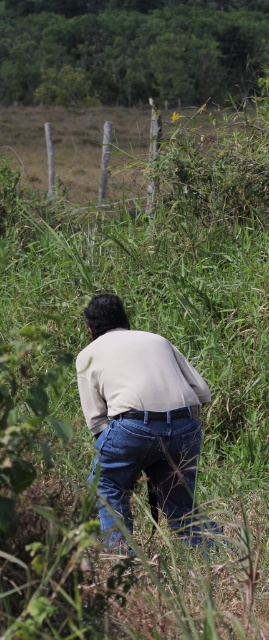
You are a hiker who wants to cross the grassy area without getting your pants dirty. The green grass at upper center and blue denim jeans at center are in your path. Which area should you avoid stepping on to keep your pants clean?

You should avoid stepping on the green grass at upper center because it is taller than the blue denim jeans at center, meaning the grass is higher and may splash mud or dirt onto your pants when walking through it.

You are a photographer trying to capture a closeup of the light beige shirt at center while also including the green grass at upper center in the frame. Based on their sizes, which object will require you to adjust your camera to a wider angle to ensure both are fully visible?

The green grass at upper center has a larger width than the light beige shirt at center, so you will need to adjust your camera to a wider angle to accommodate its greater width and ensure both objects are fully visible in the frame.